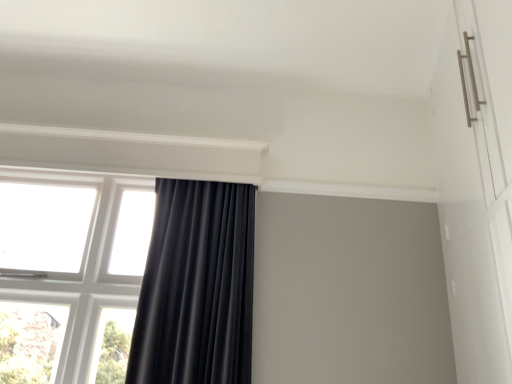
Question: Is black velvet curtain at center outside transparent glass window at left?

Choices:
 (A) yes
 (B) no

Answer: (A)

Question: Is black velvet curtain at center taller than transparent glass window at left?

Choices:
 (A) yes
 (B) no

Answer: (B)

Question: Are black velvet curtain at center and transparent glass window at left far apart?

Choices:
 (A) no
 (B) yes

Answer: (A)

Question: Does black velvet curtain at center have a larger size compared to transparent glass window at left?

Choices:
 (A) no
 (B) yes

Answer: (B)

Question: Is black velvet curtain at center in front of transparent glass window at left?

Choices:
 (A) no
 (B) yes

Answer: (B)

Question: From a real-world perspective, is black velvet curtain at center positioned over transparent glass window at left based on gravity?

Choices:
 (A) yes
 (B) no

Answer: (B)

Question: Is transparent glass window at left not near black velvet curtain at center?

Choices:
 (A) no
 (B) yes

Answer: (A)

Question: Does transparent glass window at left have a greater width compared to black velvet curtain at center?

Choices:
 (A) no
 (B) yes

Answer: (A)

Question: Are transparent glass window at left and black velvet curtain at center making contact?

Choices:
 (A) yes
 (B) no

Answer: (B)

Question: Considering the relative sizes of transparent glass window at left and black velvet curtain at center in the image provided, is transparent glass window at left thinner than black velvet curtain at center?

Choices:
 (A) yes
 (B) no

Answer: (A)

Question: Is black velvet curtain at center at the back of transparent glass window at left?

Choices:
 (A) yes
 (B) no

Answer: (B)

Question: Is transparent glass window at left closer to camera compared to black velvet curtain at center?

Choices:
 (A) no
 (B) yes

Answer: (A)

Question: Is point (69, 192) closer or farther from the camera than point (189, 266)?

Choices:
 (A) closer
 (B) farther

Answer: (B)